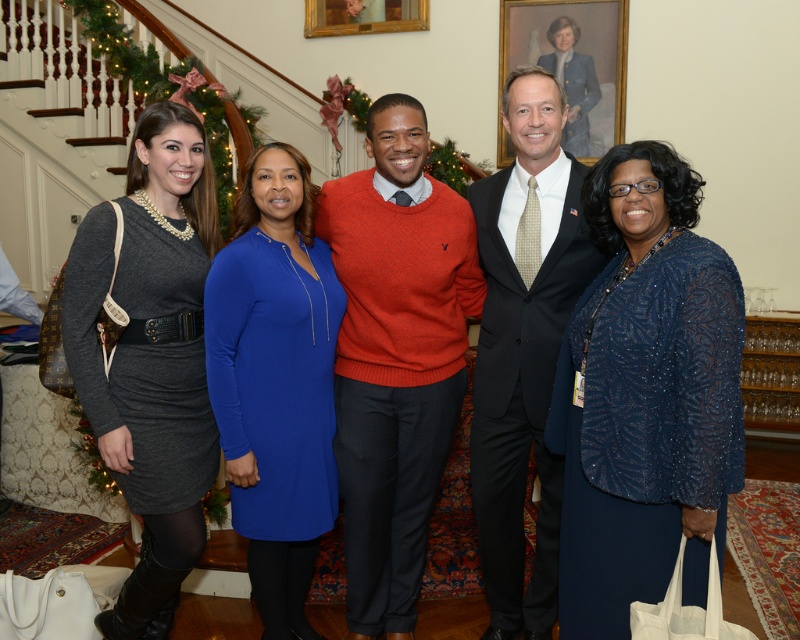
Question: Is sparkly blue dress at right smaller than matte blue dress at center?

Choices:
 (A) yes
 (B) no

Answer: (B)

Question: Which of these objects is positioned farthest from the matte gray dress at left?

Choices:
 (A) matte blue dress at center
 (B) dark suit at center
 (C) sparkly blue dress at right
 (D) orange sweater at center

Answer: (A)

Question: Is matte gray dress at left to the right of matte blue dress at center from the viewer's perspective?

Choices:
 (A) no
 (B) yes

Answer: (A)

Question: Which point appears farthest from the camera in this image?

Choices:
 (A) (322, 214)
 (B) (588, 140)
 (C) (482, 204)

Answer: (B)

Question: Is sparkly blue dress at right closer to the viewer compared to matte gray dress at left?

Choices:
 (A) yes
 (B) no

Answer: (A)

Question: Estimate the real-world distances between objects in this image. Which object is closer to the dark suit at center?

Choices:
 (A) matte gray dress at left
 (B) sparkly blue dress at right
 (C) matte blue dress at center

Answer: (B)